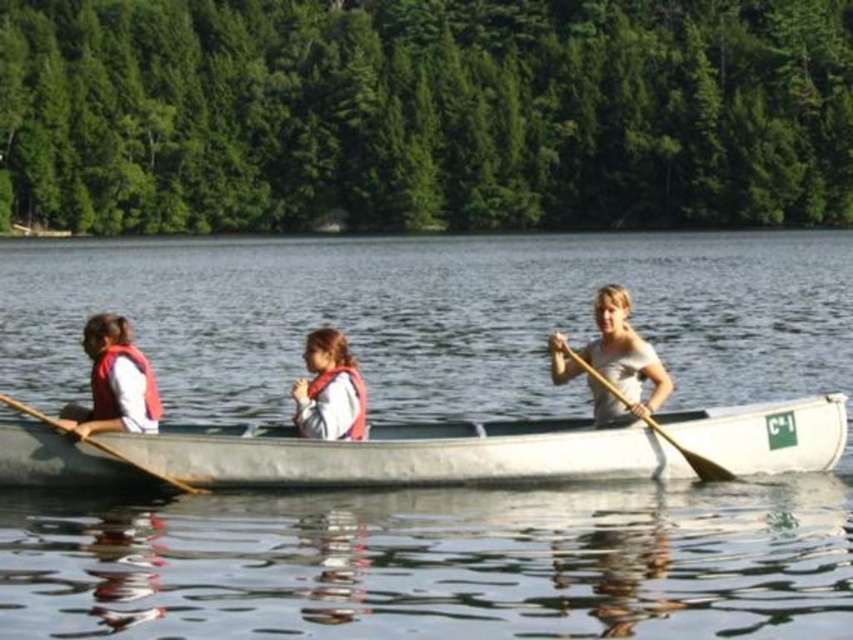
Question: Estimate the real-world distances between objects in this image. Which object is closer to the clear water at center?

Choices:
 (A) matte red life vest at left
 (B) wooden paddle at center
 (C) white matte life vest at center
 (D) white cotton shirt at center

Answer: (C)

Question: Observing the image, what is the correct spatial positioning of matte red life vest at left in reference to white matte life vest at center?

Choices:
 (A) below
 (B) above

Answer: (A)

Question: Can you confirm if clear water at center is thinner than wooden paddle at center?

Choices:
 (A) yes
 (B) no

Answer: (B)

Question: Is white cotton shirt at center above white matte life vest at center?

Choices:
 (A) yes
 (B) no

Answer: (A)

Question: Among these points, which one is nearest to the camera?

Choices:
 (A) (306, 410)
 (B) (616, 396)
 (C) (1, 396)

Answer: (A)

Question: Which object is positioned farthest from the white matte life vest at center?

Choices:
 (A) wooden paddle at left
 (B) matte red life vest at left
 (C) white cotton shirt at center
 (D) clear water at center

Answer: (D)